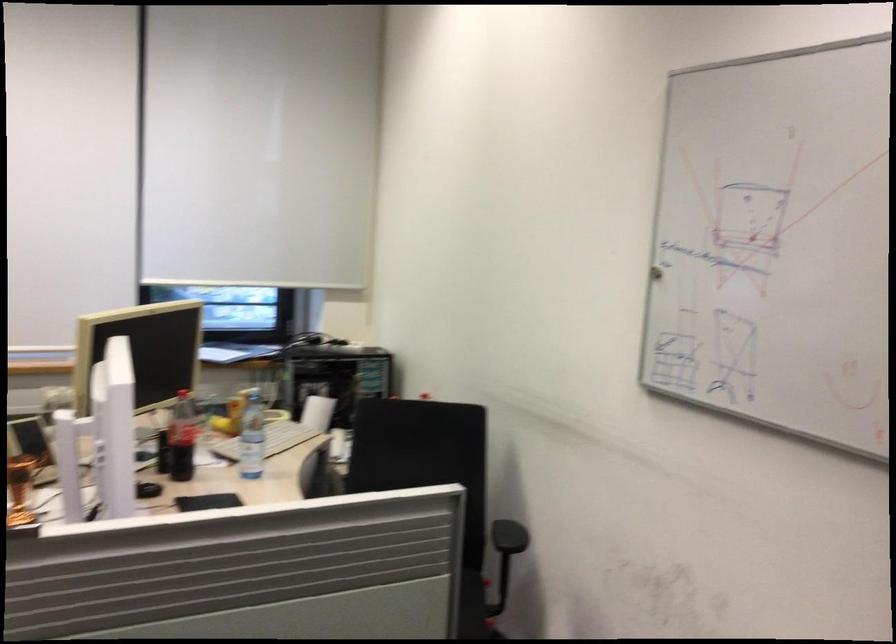
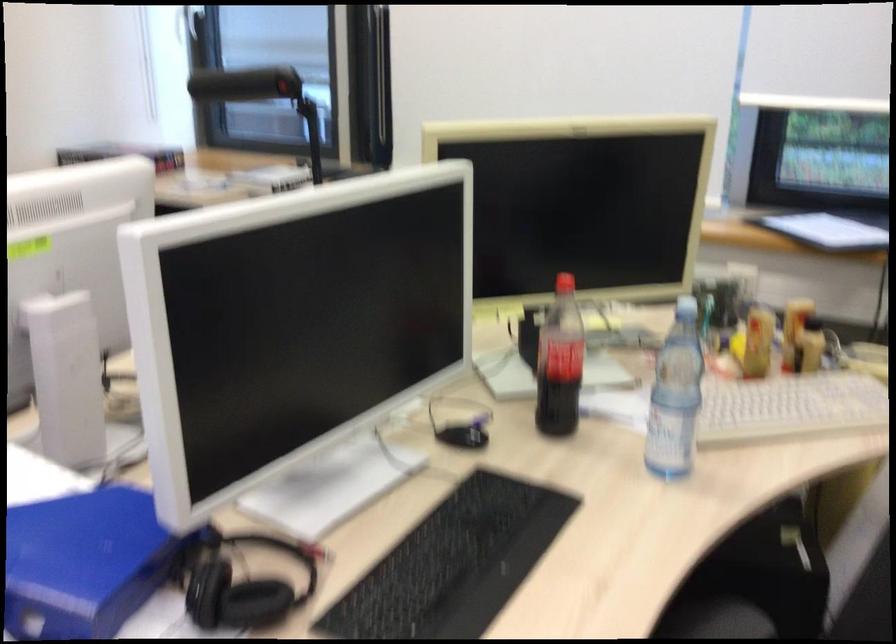
Where in the second image is the point corresponding to (182,438) from the first image?

(581, 371)